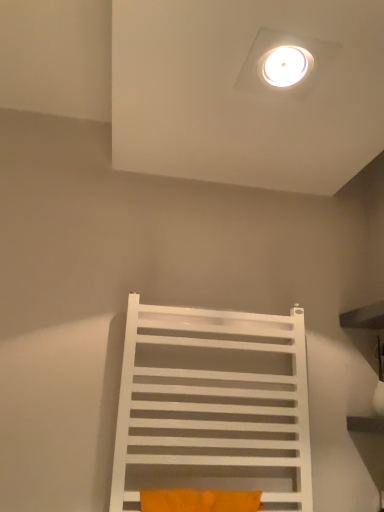
You are a GUI agent. You are given a task and a screenshot of the screen. Output one action in this format:
    pyautogui.click(x=<x>, y=<y>)
    Task: Click on the orange fabric pillow at lower center
    This screenshot has height=512, width=384.
    Given the screenshot: What is the action you would take?
    pyautogui.click(x=199, y=500)

What do you see at coordinates (199, 500) in the screenshot? The height and width of the screenshot is (512, 384). I see `orange fabric pillow at lower center` at bounding box center [199, 500].

Measure the distance between white matte towel rack at center and camera.

white matte towel rack at center and camera are 3.38 feet apart.

Identify the location of white matte towel rack at center. The height and width of the screenshot is (512, 384). (213, 405).

Describe the element at coordinates (213, 405) in the screenshot. I see `white matte towel rack at center` at that location.

The width and height of the screenshot is (384, 512). Identify the location of orange fabric pillow at lower center. (199, 500).

Which is more to the right, white matte towel rack at center or orange fabric pillow at lower center?

orange fabric pillow at lower center.

Is white matte towel rack at center further to camera compared to orange fabric pillow at lower center?

Yes, white matte towel rack at center is further from the camera.

Between point (237, 483) and point (237, 508), which one is positioned in front?

The point (237, 508) is closer.

From the image's perspective, between white matte towel rack at center and orange fabric pillow at lower center, who is located below?

orange fabric pillow at lower center, from the image's perspective.

Consider the image. From a real-world perspective, is white matte towel rack at center located higher than orange fabric pillow at lower center?

Yes.

Is white matte towel rack at center wider than orange fabric pillow at lower center?

Indeed, white matte towel rack at center has a greater width compared to orange fabric pillow at lower center.

Considering the sizes of objects white matte towel rack at center and orange fabric pillow at lower center in the image provided, who is shorter, white matte towel rack at center or orange fabric pillow at lower center?

orange fabric pillow at lower center.

Considering the sizes of objects white matte towel rack at center and orange fabric pillow at lower center in the image provided, who is smaller, white matte towel rack at center or orange fabric pillow at lower center?

orange fabric pillow at lower center is smaller.

Is white matte towel rack at center not inside orange fabric pillow at lower center?

white matte towel rack at center lies outside orange fabric pillow at lower center's area.

Is white matte towel rack at center in contact with orange fabric pillow at lower center?

No, white matte towel rack at center is not beside orange fabric pillow at lower center.

Is white matte towel rack at center looking in the opposite direction of orange fabric pillow at lower center?

No, white matte towel rack at center is not facing the opposite direction of orange fabric pillow at lower center.

How many degrees apart are the facing directions of white matte towel rack at center and orange fabric pillow at lower center?

They differ by 0.00173 degrees in their facing directions.

In the image, there is a white matte towel rack at center. At what (x,y) coordinates should I click in order to perform the action: click on pillow below it (from the image's perspective). Please return your answer as a coordinate pair (x, y). Looking at the image, I should click on (199, 500).

In the image, is orange fabric pillow at lower center on the left side or the right side of white matte towel rack at center?

In the image, orange fabric pillow at lower center appears on the right side of white matte towel rack at center.

Does orange fabric pillow at lower center come in front of white matte towel rack at center?

Yes, it is.

Does point (241, 503) come farther from viewer compared to point (190, 423)?

That is False.

From the image's perspective, is orange fabric pillow at lower center below white matte towel rack at center?

Yes.

Looking at this image, from a real-world perspective, is orange fabric pillow at lower center below white matte towel rack at center?

Correct, in the physical world, orange fabric pillow at lower center is lower than white matte towel rack at center.

Consider the image. Between orange fabric pillow at lower center and white matte towel rack at center, which one has smaller width?

With smaller width is orange fabric pillow at lower center.

Is orange fabric pillow at lower center shorter than white matte towel rack at center?

Indeed, orange fabric pillow at lower center has a lesser height compared to white matte towel rack at center.

Looking at the image, does orange fabric pillow at lower center seem bigger or smaller compared to white matte towel rack at center?

orange fabric pillow at lower center is smaller than white matte towel rack at center.

Would you say orange fabric pillow at lower center is outside white matte towel rack at center?

That's incorrect, orange fabric pillow at lower center is not completely outside white matte towel rack at center.

Is orange fabric pillow at lower center not close to white matte towel rack at center?

No, orange fabric pillow at lower center is not far from white matte towel rack at center.

Is orange fabric pillow at lower center oriented away from white matte towel rack at center?

Absolutely, orange fabric pillow at lower center is directed away from white matte towel rack at center.

How different are the orientations of orange fabric pillow at lower center and white matte towel rack at center in degrees?

0.00173 degrees separate the facing orientations of orange fabric pillow at lower center and white matte towel rack at center.

Measure the distance from orange fabric pillow at lower center to white matte towel rack at center.

A distance of 8.48 inches exists between orange fabric pillow at lower center and white matte towel rack at center.

Where is `furniture positioned vertically above the orange fabric pillow at lower center (from a real-world perspective)`? furniture positioned vertically above the orange fabric pillow at lower center (from a real-world perspective) is located at coordinates (213, 405).

The width and height of the screenshot is (384, 512). I want to click on furniture behind the orange fabric pillow at lower center, so click(213, 405).

In order to click on furniture on the left of orange fabric pillow at lower center in this screenshot , I will do `click(213, 405)`.